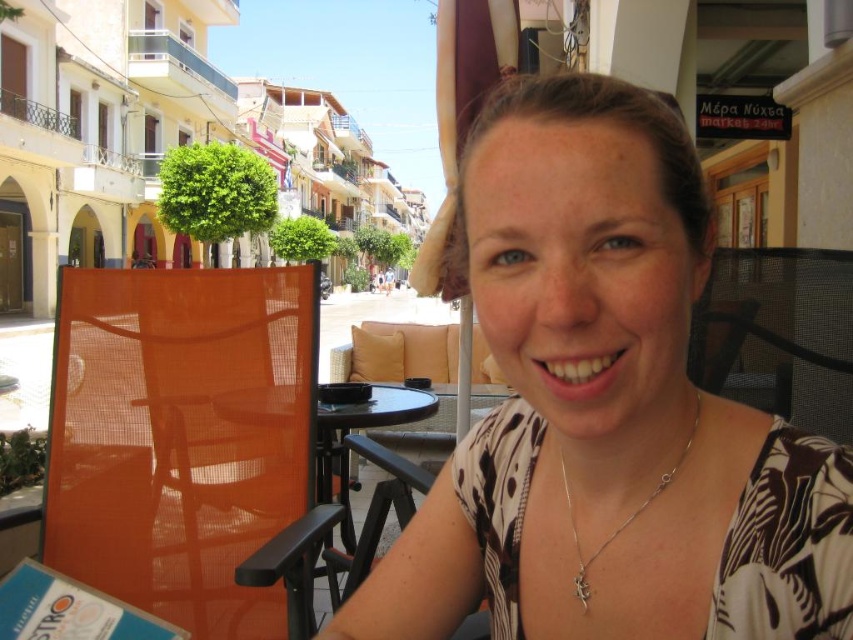
Question: Which object is the farthest from the black glass table at center?

Choices:
 (A) white printed blouse at center
 (B) beige fabric chair at center

Answer: (B)

Question: Which point is farther to the camera?

Choices:
 (A) (412, 324)
 (B) (697, 392)
 (C) (830, 621)
 (D) (436, 400)

Answer: (A)

Question: Can you confirm if orange mesh chair at left is thinner than silver/chain/necklace at center?

Choices:
 (A) yes
 (B) no

Answer: (B)

Question: Is orange mesh chair at left bigger than silver/chain/necklace at center?

Choices:
 (A) no
 (B) yes

Answer: (B)

Question: Which is nearer to the beige fabric chair at center?

Choices:
 (A) black glass table at center
 (B) white printed blouse at center
 (C) orange mesh chair at left

Answer: (A)

Question: Can you confirm if white printed blouse at center is bigger than orange mesh chair at left?

Choices:
 (A) no
 (B) yes

Answer: (A)